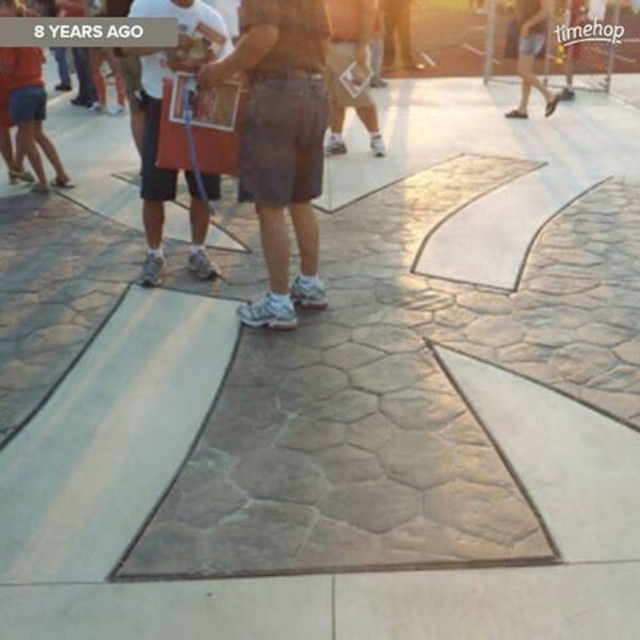
Is brown suede shorts at center shorter than white denim shorts at upper right?

No.

Measure the distance from brown suede shorts at center to white denim shorts at upper right.

19.19 feet

Does point (321, 296) come closer to viewer compared to point (547, 29)?

Yes, point (321, 296) is in front of point (547, 29).

At what (x,y) coordinates should I click in order to perform the action: click on brown suede shorts at center. Please return your answer as a coordinate pair (x, y). The height and width of the screenshot is (640, 640). Looking at the image, I should click on (280, 141).

Is point (276, 298) farther from viewer compared to point (192, 241)?

No.

Between brown suede shorts at center and matte black shorts at center, which one is positioned higher?

matte black shorts at center is higher up.

Which is in front, point (269, 264) or point (164, 3)?

Point (269, 264) is in front.

Locate an element on the screen. brown suede shorts at center is located at coordinates (280, 141).

Does matte black shorts at center have a smaller size compared to brown textured shorts at center?

No, matte black shorts at center is not smaller than brown textured shorts at center.

Does point (166, 76) come closer to viewer compared to point (337, 56)?

That is True.

Who is more distant from viewer, (x=144, y=214) or (x=342, y=20)?

Point (x=342, y=20)

Find the location of a particular element. This screenshot has height=640, width=640. matte black shorts at center is located at coordinates (161, 104).